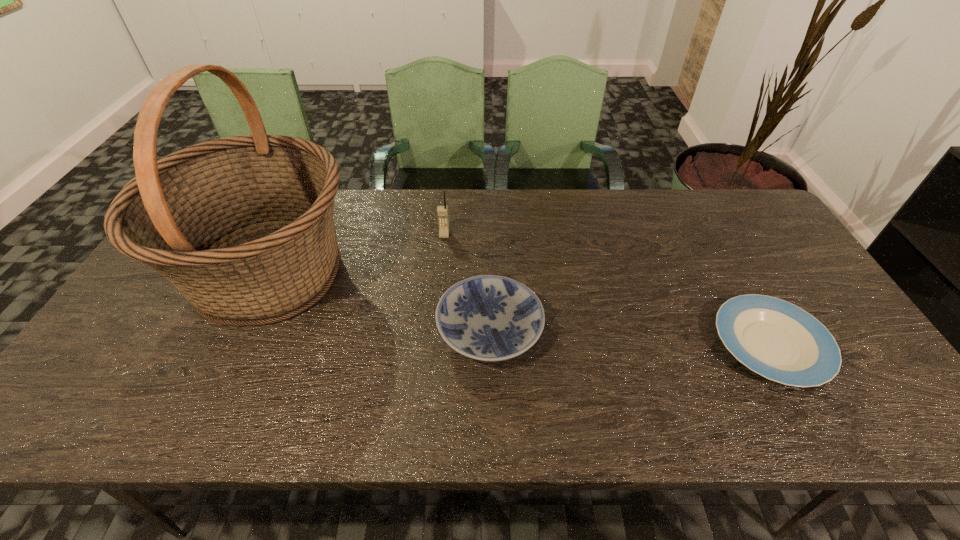
At what (x,y) coordinates should I click in order to perform the action: click on free point located 0.360m on the back of the right plate. Please return your answer as a coordinate pair (x, y). The height and width of the screenshot is (540, 960). Looking at the image, I should click on (700, 218).

The image size is (960, 540). What are the coordinates of `basket that is at the far edge` in the screenshot? It's located at (242, 226).

Where is `cellular telephone that is at the far edge`? This screenshot has height=540, width=960. cellular telephone that is at the far edge is located at coordinates (442, 211).

Where is `object present at the near edge`? This screenshot has height=540, width=960. object present at the near edge is located at coordinates (778, 340).

I want to click on object at the left edge, so click(242, 226).

This screenshot has width=960, height=540. Identify the location of object present at the right edge. (778, 340).

Identify the location of object that is at the far left corner. The width and height of the screenshot is (960, 540). (242, 226).

What are the coordinates of `object present at the near right corner` in the screenshot? It's located at (778, 340).

I want to click on vacant space at the far edge of the desktop, so click(x=429, y=224).

Identify the location of vacant space at the near edge of the desktop. (700, 397).